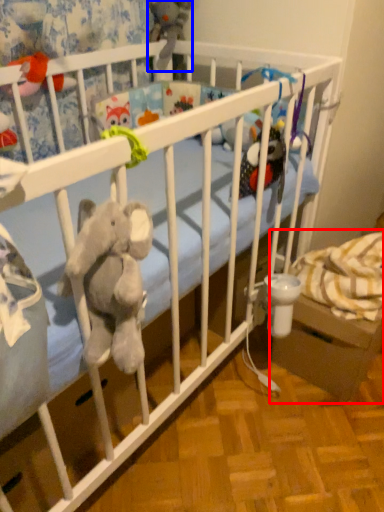
Question: Which object appears closest to the camera in this image, baby carriage (highlighted by a red box) or toy (highlighted by a blue box)?

Choices:
 (A) baby carriage
 (B) toy

Answer: (A)